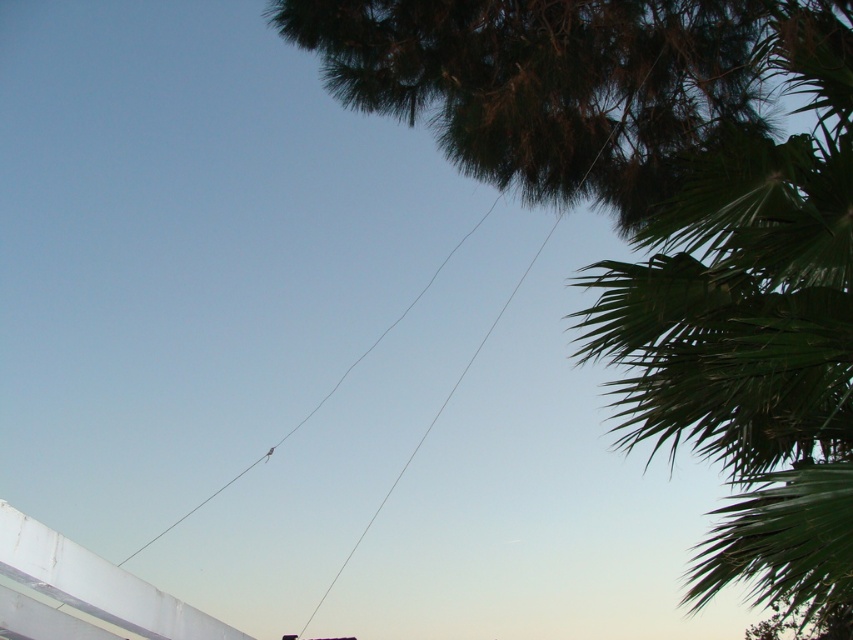
Who is shorter, green leafy tree at upper right or green leafy palm tree at upper right?

green leafy tree at upper right

Between green leafy tree at upper right and green leafy palm tree at upper right, which one has more height?

green leafy palm tree at upper right

Image resolution: width=853 pixels, height=640 pixels. What do you see at coordinates (666, 220) in the screenshot?
I see `green leafy tree at upper right` at bounding box center [666, 220].

Where is `green leafy tree at upper right`? The height and width of the screenshot is (640, 853). green leafy tree at upper right is located at coordinates (666, 220).

Measure the distance between point [407,44] and camera.

Point [407,44] and camera are 22.09 feet apart.

Between point (553, 93) and point (399, 317), which one is positioned in front?

Point (553, 93) is more forward.

Which is in front, point (849, 401) or point (143, 545)?

Point (849, 401) is in front.

You are a GUI agent. You are given a task and a screenshot of the screen. Output one action in this format:
    pyautogui.click(x=<x>, y=<y>)
    Task: Click on the green leafy tree at upper right
    
    Given the screenshot: What is the action you would take?
    click(666, 220)

From the picture: Is green leafy palm tree at upper right taller than clear wire at center?

Correct, green leafy palm tree at upper right is much taller as clear wire at center.

The height and width of the screenshot is (640, 853). What do you see at coordinates (755, 333) in the screenshot? I see `green leafy palm tree at upper right` at bounding box center [755, 333].

Who is more distant from viewer, (738,493) or (445,253)?

The point (445,253) is more distant.

You are a GUI agent. You are given a task and a screenshot of the screen. Output one action in this format:
    pyautogui.click(x=<x>, y=<y>)
    Task: Click on the green leafy palm tree at upper right
    
    Given the screenshot: What is the action you would take?
    pyautogui.click(x=755, y=333)